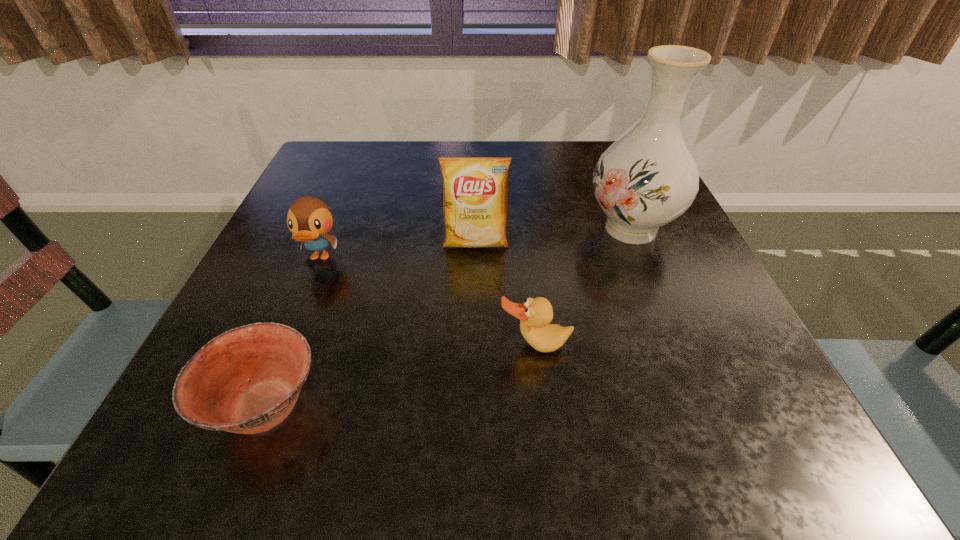
Find the location of a particular element. The width and height of the screenshot is (960, 540). vacant space at the right edge of the desktop is located at coordinates (665, 267).

What are the coordinates of `free location at the far left corner of the desktop` in the screenshot? It's located at (342, 157).

Where is `empty space between the vase and the nearer duck`? empty space between the vase and the nearer duck is located at coordinates (583, 287).

The width and height of the screenshot is (960, 540). Identify the location of empty location between the shorter duck and the nearest object. (400, 375).

I want to click on free space between the second nearest object and the bowl, so click(x=400, y=375).

You are a GUI agent. You are given a task and a screenshot of the screen. Output one action in this format:
    pyautogui.click(x=<x>, y=<y>)
    Task: Click on the free space between the tallest object and the crisp (potato chip)
    The height and width of the screenshot is (540, 960).
    Given the screenshot: What is the action you would take?
    (x=553, y=236)

You are a GUI agent. You are given a task and a screenshot of the screen. Output one action in this format:
    pyautogui.click(x=<x>, y=<y>)
    Task: Click on the empty space that is in between the crisp (potato chip) and the third shortest object
    
    Given the screenshot: What is the action you would take?
    pyautogui.click(x=397, y=251)

This screenshot has height=540, width=960. I want to click on empty space that is in between the bowl and the rightmost object, so click(448, 317).

The height and width of the screenshot is (540, 960). I want to click on free space between the nearer duck and the rightmost object, so click(x=583, y=287).

Where is `vacant space in between the nearest object and the vase`? vacant space in between the nearest object and the vase is located at coordinates click(x=448, y=317).